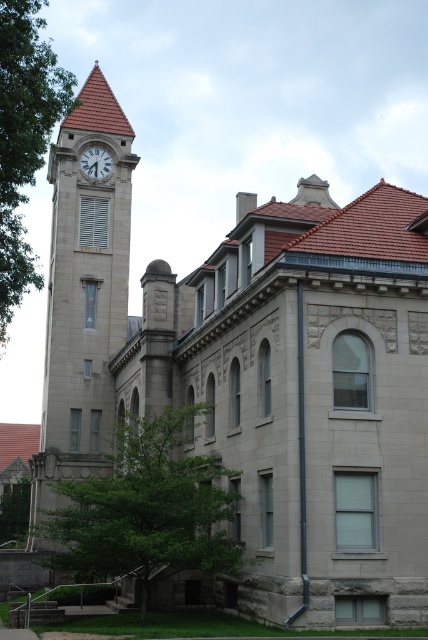
Question: Is green leafy tree at left to the left of green leafy tree at lower left from the viewer's perspective?

Choices:
 (A) yes
 (B) no

Answer: (B)

Question: Can you confirm if green leafy tree at left is positioned to the left of white marble clock at upper left?

Choices:
 (A) yes
 (B) no

Answer: (B)

Question: Which object is positioned closest to the green leafy tree at lower center?

Choices:
 (A) green leafy tree at lower left
 (B) green leafy tree at left

Answer: (B)

Question: Which object appears closest to the camera in this image?

Choices:
 (A) stone clock tower at left
 (B) green leafy tree at lower left
 (C) white marble clock at upper left

Answer: (A)

Question: Does green leafy tree at left appear over white marble clock at upper left?

Choices:
 (A) yes
 (B) no

Answer: (B)

Question: Which point is farther to the camera?

Choices:
 (A) stone clock tower at left
 (B) white marble clock at upper left

Answer: (B)